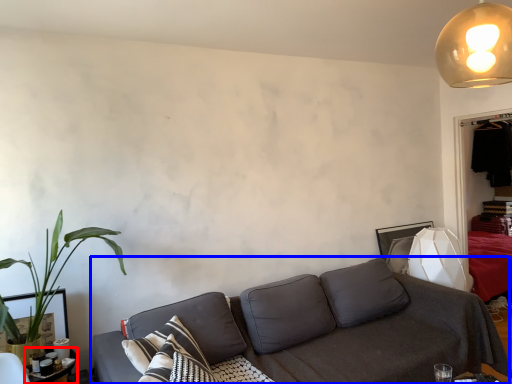
Question: Which object appears farthest to the camera in this image, table (highlighted by a red box) or studio couch (highlighted by a blue box)?

Choices:
 (A) table
 (B) studio couch

Answer: (A)